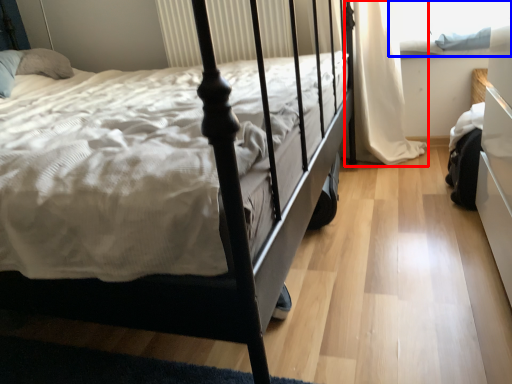
Question: Which of the following is the farthest to the observer, curtain (highlighted by a red box) or window screen (highlighted by a blue box)?

Choices:
 (A) curtain
 (B) window screen

Answer: (B)